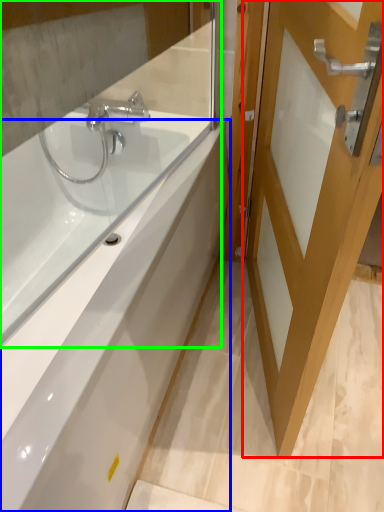
Question: Based on their relative distances, which object is nearer to door (highlighted by a red box)? Choose from bathtub (highlighted by a blue box) and mirror (highlighted by a green box).

Choices:
 (A) bathtub
 (B) mirror

Answer: (A)